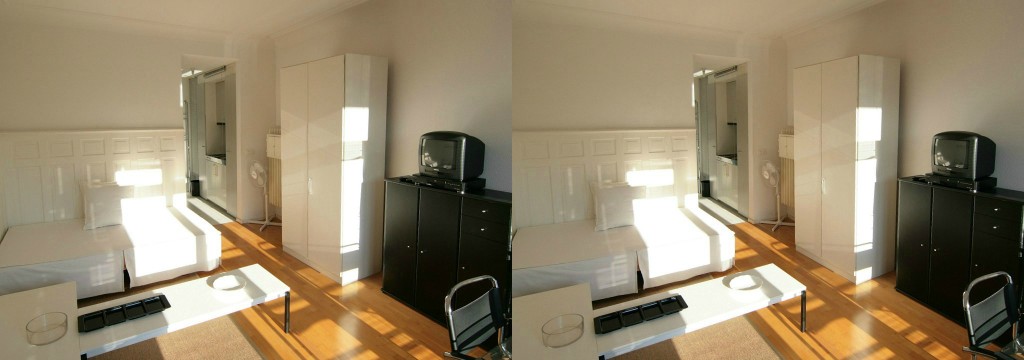
The height and width of the screenshot is (360, 1024). Identify the location of standing fan. (259, 171), (768, 171).